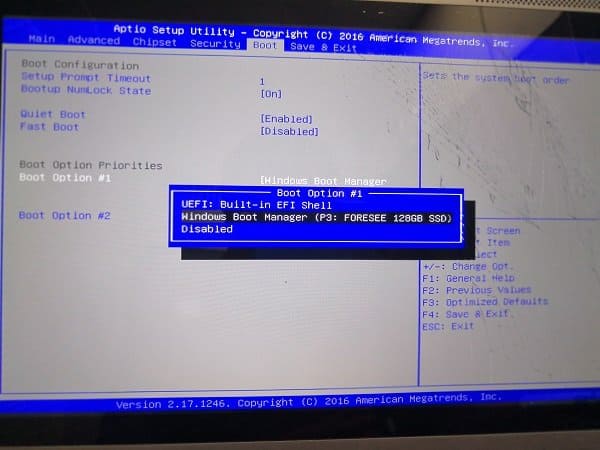
The image size is (600, 450). I want to click on monitor, so click(303, 304).